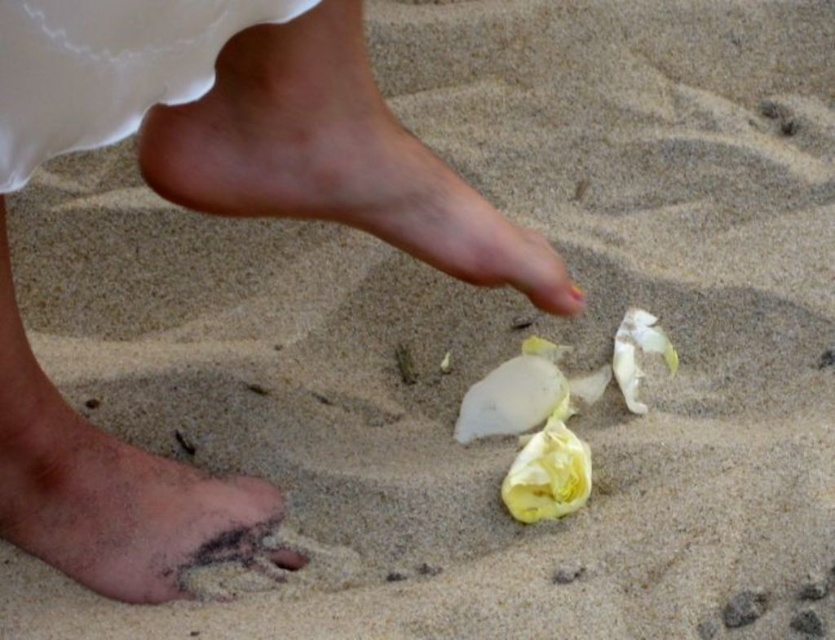
You are a photographer trying to capture the contrast between the two feet in the image. Which foot, the smooth skin foot at lower left or the brown sandy foot at lower left, appears larger in height in the photo?

The smooth skin foot at lower left is much taller than the brown sandy foot at lower left, so it appears larger in height in the photo.

You are a photographer trying to capture the exact position of the feet in the image. Which foot is positioned higher up in the frame between the smooth skin foot at lower left and the brown sandy foot at lower left?

The smooth skin foot at lower left is positioned higher up in the frame than the brown sandy foot at lower left because it is described as being above the latter.

You are a photographer trying to capture the pink skin at center and brown sandy foot at lower left in the same frame. Based on their positions, which object would appear larger in the photo?

The pink skin at center appears larger in the photo because it has a greater height compared to the brown sandy foot at lower left.